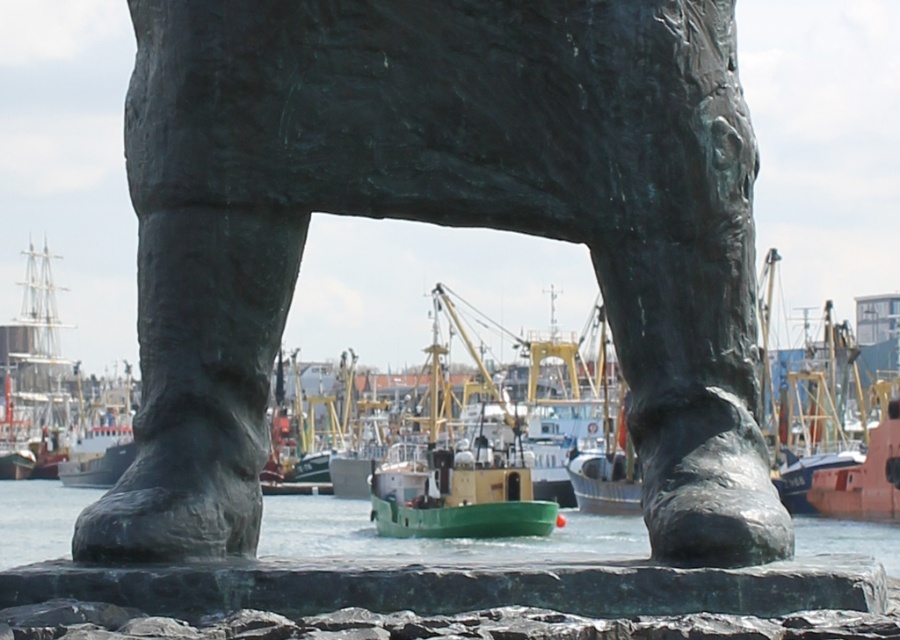
What is the exact location of the bronze statue at center in the image?

The bronze statue at center is located at point (x=438, y=224).

Based on the photo, you are standing in front of the bronze statue at center and want to take a photo of the green matte boat at center. Since both are in the center, will the statue block your view of the boat?

The bronze statue at center is closer to the viewer than the green matte boat at center, so the statue will block the view of the boat.

You are standing in front of the bronze statue at center and want to see the green matte water at center behind it. Can you move around the statue to get a clear view of the water?

The bronze statue at center is closer to the viewer than the green matte water at center, so moving around it may allow you to see the water behind it.